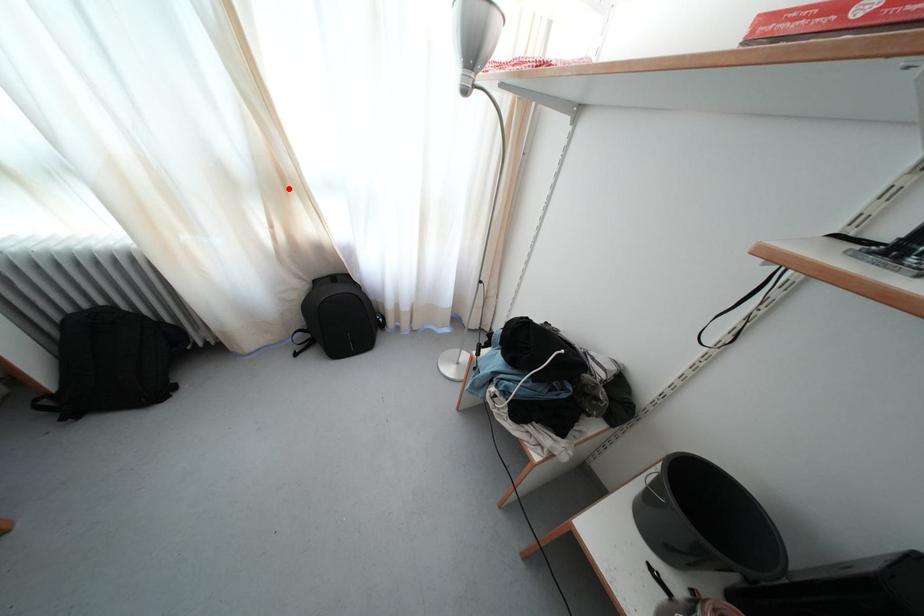
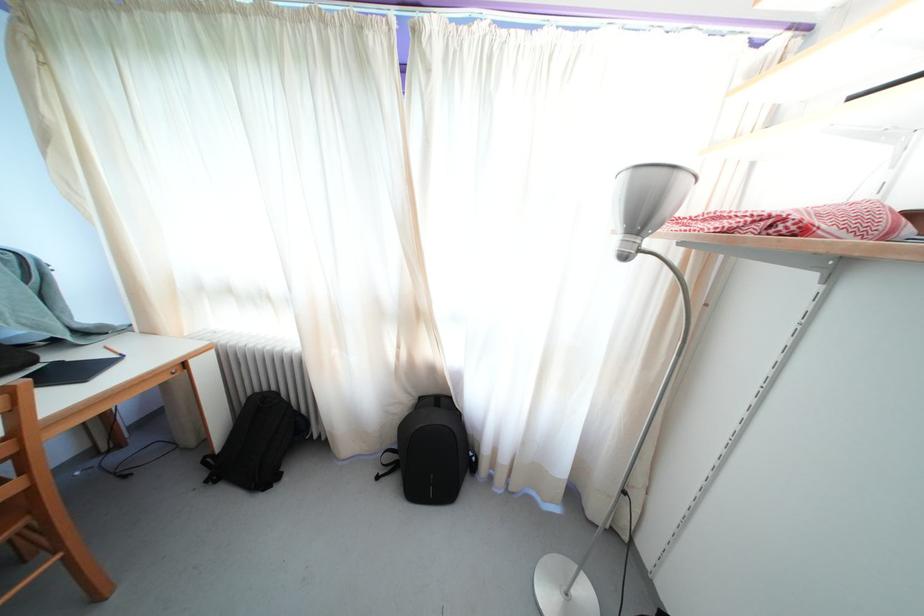
Locate, in the second image, the point that corresponds to the highlighted location in the first image.

(421, 321)